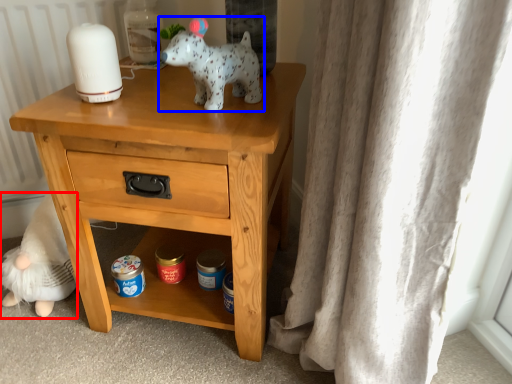
Question: Which of the following is the farthest to the observer, figurine (highlighted by a red box) or toy (highlighted by a blue box)?

Choices:
 (A) figurine
 (B) toy

Answer: (A)